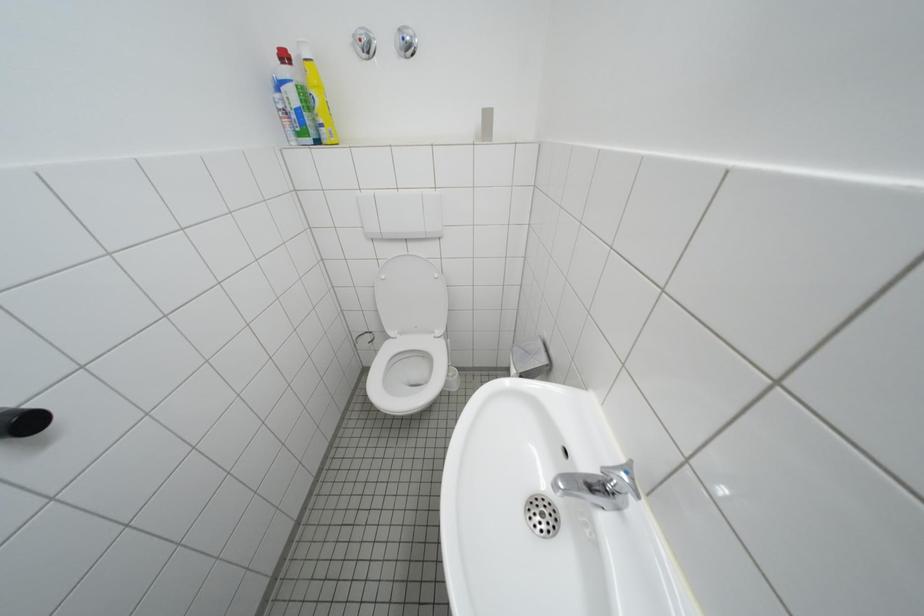
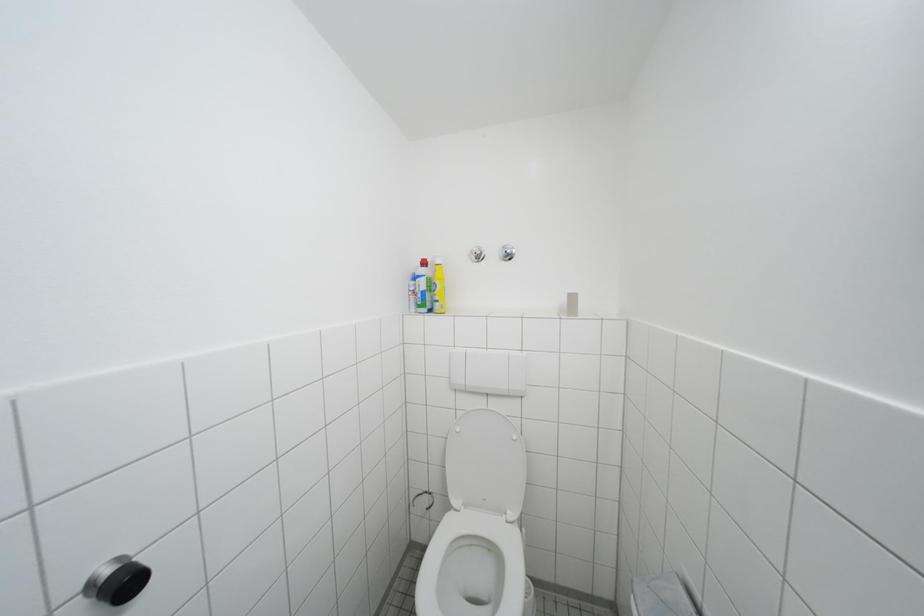
The first image is from the beginning of the video and the second image is from the end. How did the camera likely rotate when shooting the video?

The rotation direction of the camera is left-up.